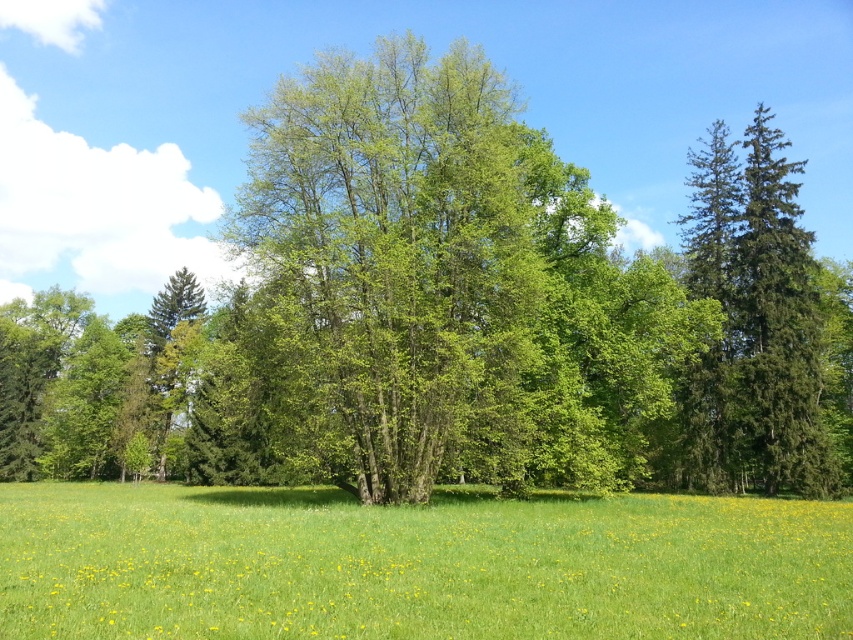
Question: Can you confirm if green leafy tree at center is positioned to the left of green grassy pasture at center?

Choices:
 (A) yes
 (B) no

Answer: (B)

Question: Does green leafy tree at center have a greater width compared to green grassy pasture at center?

Choices:
 (A) yes
 (B) no

Answer: (A)

Question: From the image, what is the correct spatial relationship of green leafy tree at center in relation to green grassy pasture at center?

Choices:
 (A) left
 (B) right

Answer: (B)

Question: Which object appears farthest from the camera in this image?

Choices:
 (A) green leafy tree at center
 (B) green grassy pasture at center

Answer: (A)